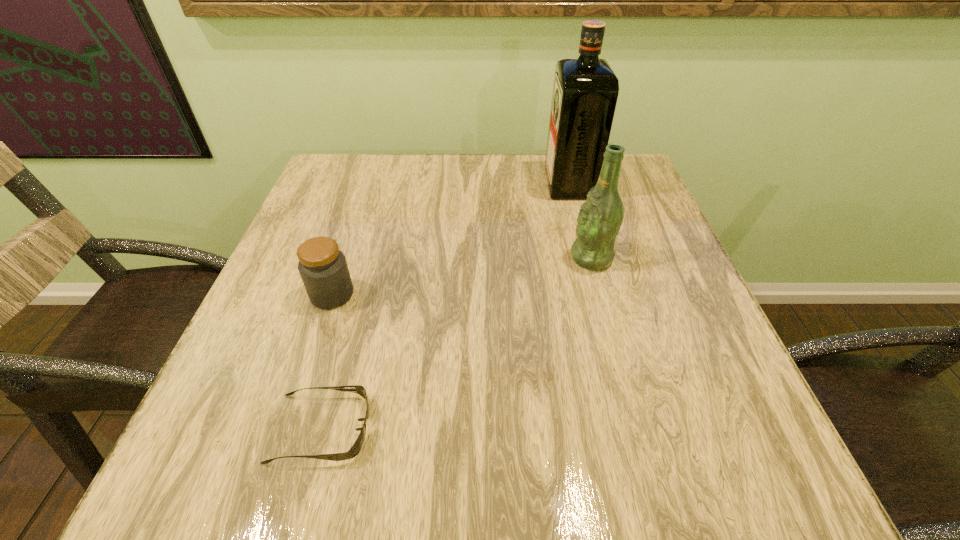
Locate an element on the screen. This screenshot has width=960, height=540. vacant space that's between the jar and the liquor is located at coordinates (450, 239).

The image size is (960, 540). Identify the location of empty space between the second nearest object and the sunglasses. (326, 361).

Where is `unoccupied position between the liquor and the second shortest object`? This screenshot has width=960, height=540. unoccupied position between the liquor and the second shortest object is located at coordinates (450, 239).

Identify the location of blank region between the third tallest object and the farthest object. This screenshot has width=960, height=540. (450, 239).

Where is `free space between the beer bottle and the third farthest object`? Image resolution: width=960 pixels, height=540 pixels. free space between the beer bottle and the third farthest object is located at coordinates (462, 276).

Find the location of a particular element. The height and width of the screenshot is (540, 960). free point between the third farthest object and the second farthest object is located at coordinates (462, 276).

Where is `vacant area that lies between the beer bottle and the nearest object`? vacant area that lies between the beer bottle and the nearest object is located at coordinates (456, 343).

What are the coordinates of `free space that is in between the jar and the tallest object` in the screenshot? It's located at click(x=450, y=239).

The height and width of the screenshot is (540, 960). I want to click on object identified as the third closest to the jar, so (585, 91).

Select which object appears as the closest to the liquor. Please provide its 2D coordinates. Your answer should be formatted as a tuple, i.e. [(x, y)], where the tuple contains the x and y coordinates of a point satisfying the conditions above.

[(599, 220)]